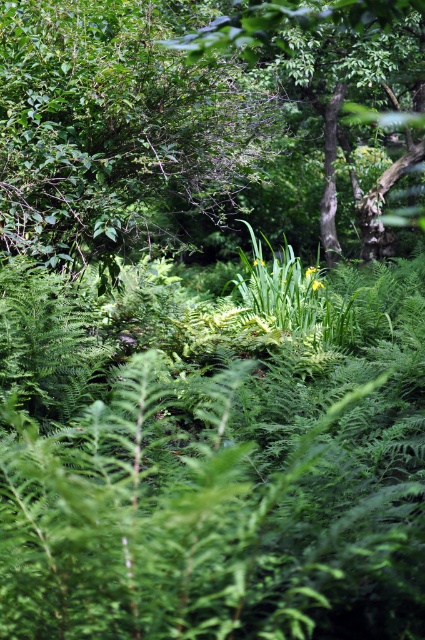
Question: Which point is closer to the camera?

Choices:
 (A) green leafy tree at upper center
 (B) green leafy tree at center

Answer: (B)

Question: Can you confirm if green leafy tree at upper center is thinner than green leafy tree at center?

Choices:
 (A) no
 (B) yes

Answer: (B)

Question: Among these points, which one is nearest to the camera?

Choices:
 (A) (422, 8)
 (B) (155, 19)

Answer: (A)

Question: Is green leafy tree at upper center behind green leafy tree at center?

Choices:
 (A) yes
 (B) no

Answer: (A)

Question: Considering the relative positions of green leafy tree at upper center and green leafy tree at center in the image provided, where is green leafy tree at upper center located with respect to green leafy tree at center?

Choices:
 (A) left
 (B) right

Answer: (A)